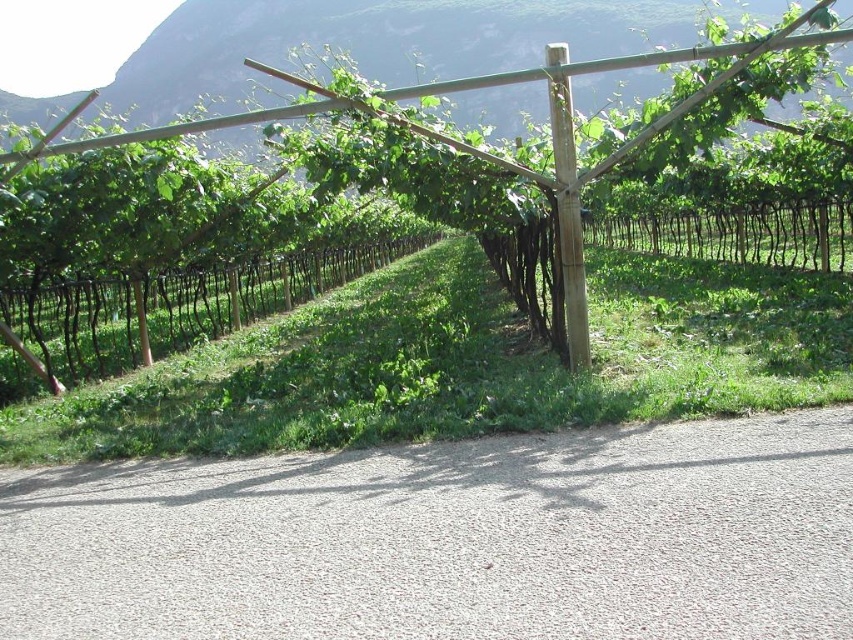
Can you confirm if gray gravel path at lower center is positioned to the right of green bamboo fence at center?

In fact, gray gravel path at lower center is to the left of green bamboo fence at center.

This screenshot has height=640, width=853. What do you see at coordinates (448, 540) in the screenshot?
I see `gray gravel path at lower center` at bounding box center [448, 540].

Locate an element on the screen. gray gravel path at lower center is located at coordinates (448, 540).

In order to click on gray gravel path at lower center in this screenshot , I will do point(448,540).

From the picture: Is green bamboo fence at center further to camera compared to green wood fence at center?

No, green bamboo fence at center is closer to the viewer.

Is point (228, 330) positioned in front of point (132, 330)?

Yes, it is.

The image size is (853, 640). What do you see at coordinates (257, 289) in the screenshot?
I see `green bamboo fence at center` at bounding box center [257, 289].

You are a GUI agent. You are given a task and a screenshot of the screen. Output one action in this format:
    pyautogui.click(x=<x>, y=<y>)
    Task: Click on the green bamboo fence at center
    This screenshot has width=853, height=640.
    Given the screenshot: What is the action you would take?
    pyautogui.click(x=257, y=289)

Does green bamboo fence at center have a larger size compared to brown wood pole at center?

Indeed, green bamboo fence at center has a larger size compared to brown wood pole at center.

Between green bamboo fence at center and brown wood pole at center, which one appears on the right side from the viewer's perspective?

From the viewer's perspective, brown wood pole at center appears more on the right side.

Does point (634, 218) lie behind point (560, 195)?

Yes, it is.

Where is `green bamboo fence at center`? The height and width of the screenshot is (640, 853). green bamboo fence at center is located at coordinates (257, 289).